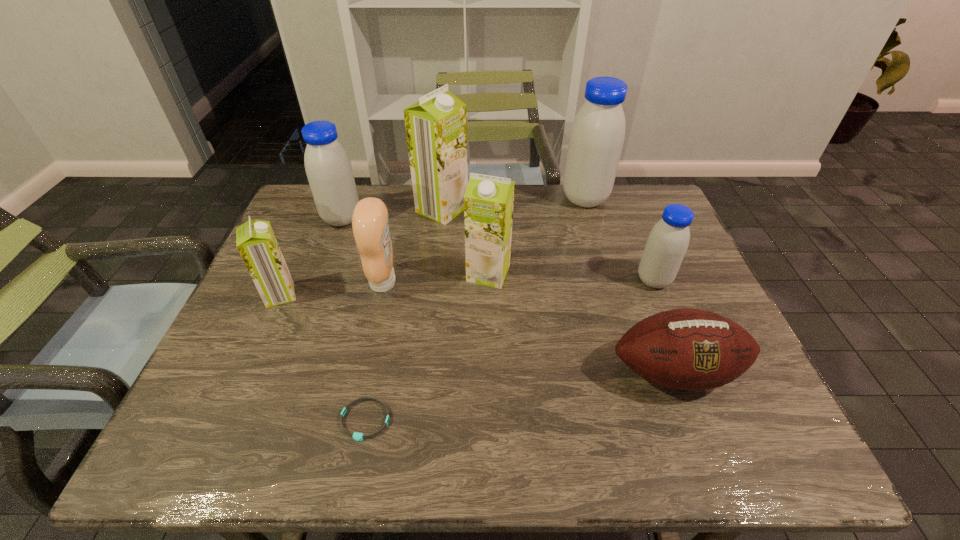
Image resolution: width=960 pixels, height=540 pixels. What are the coordinates of `green soya milk that is the third closest to the biggest blue soya milk` in the screenshot? It's located at (255, 240).

The width and height of the screenshot is (960, 540). Find the location of `green soya milk that stands as the second closest to the gray wristband`. green soya milk that stands as the second closest to the gray wristband is located at coordinates (488, 200).

Where is `vacant position in the image that satisfies the following two spatial constraints: 1. on the back side of the smallest green soya milk; 2. on the left side of the farthest green soya milk`? Image resolution: width=960 pixels, height=540 pixels. vacant position in the image that satisfies the following two spatial constraints: 1. on the back side of the smallest green soya milk; 2. on the left side of the farthest green soya milk is located at coordinates (319, 209).